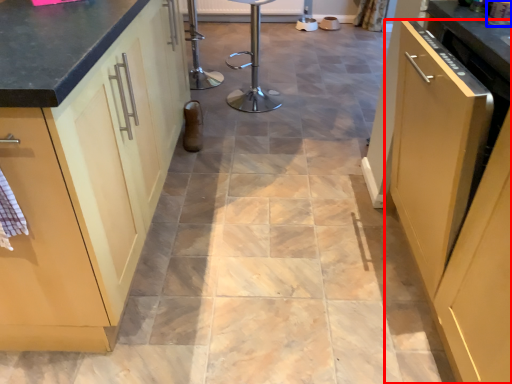
Question: Among these objects, which one is nearest to the camera, cabinetry (highlighted by a red box) or appliance (highlighted by a blue box)?

Choices:
 (A) cabinetry
 (B) appliance

Answer: (A)